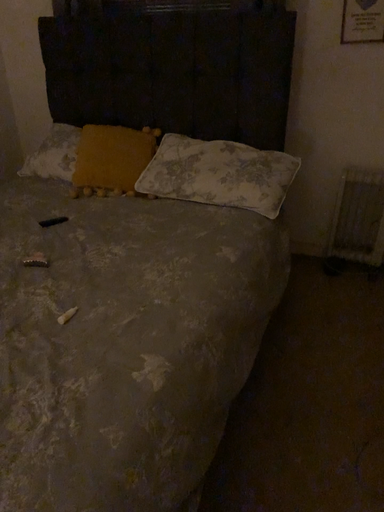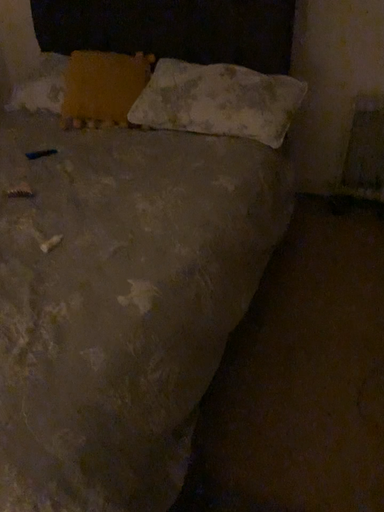
Question: Which way did the camera rotate in the video?

Choices:
 (A) rotated upward
 (B) rotated downward

Answer: (B)